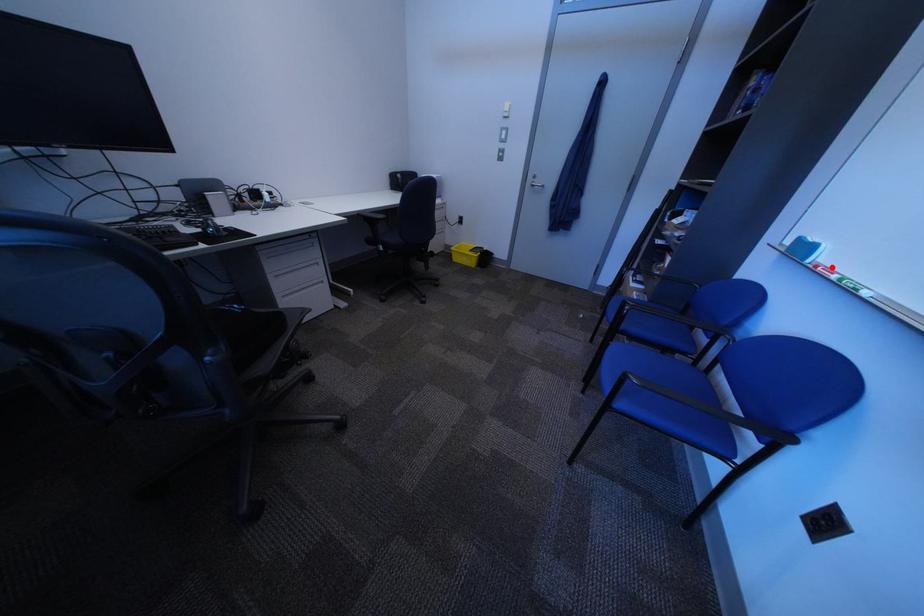
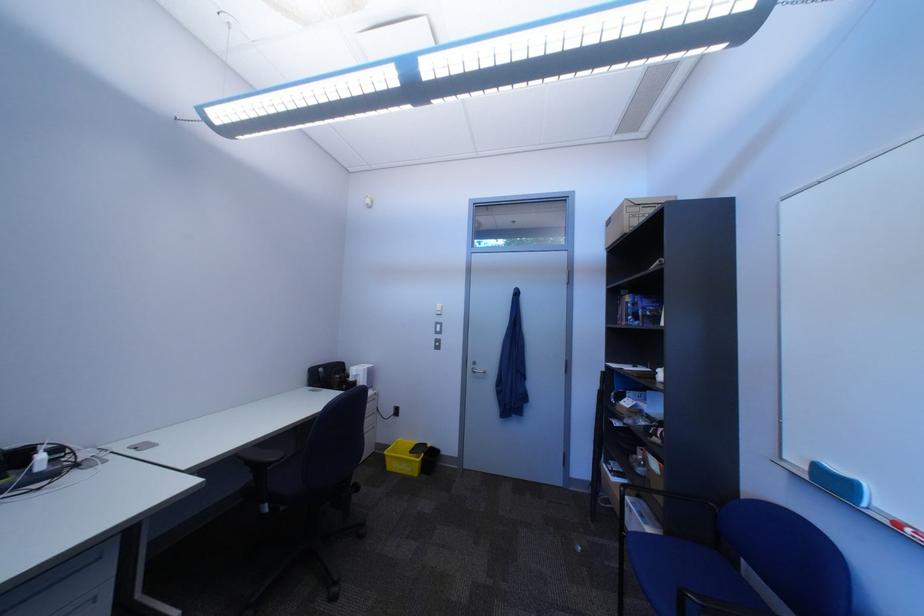
In the second image, find the point that corresponds to the highlighted location in the first image.

(915, 527)